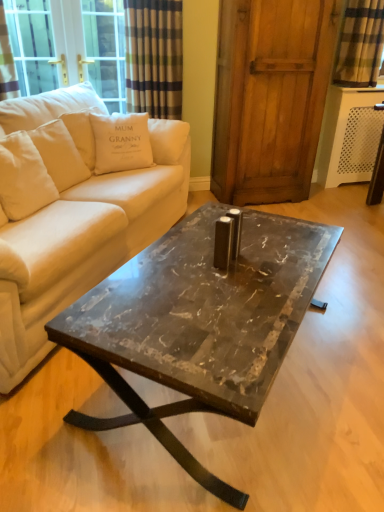
Question: Is beige fabric couch at center facing towards wooden screen door at center?

Choices:
 (A) no
 (B) yes

Answer: (A)

Question: Would you say beige fabric couch at center is a long distance from wooden screen door at center?

Choices:
 (A) no
 (B) yes

Answer: (B)

Question: Is beige fabric couch at center positioned with its back to wooden screen door at center?

Choices:
 (A) no
 (B) yes

Answer: (A)

Question: From a real-world perspective, is beige fabric couch at center physically below wooden screen door at center?

Choices:
 (A) yes
 (B) no

Answer: (A)

Question: Does beige fabric couch at center appear on the right side of wooden screen door at center?

Choices:
 (A) yes
 (B) no

Answer: (B)

Question: Would you say wooden screen door at center is part of beige fabric couch at center's contents?

Choices:
 (A) yes
 (B) no

Answer: (B)

Question: From a real-world perspective, is white cotton cushion at upper left, arranged as the second pillow when viewed from the left, positioned over white cotton pillow at upper left, which appears as the first pillow when viewed from the left, based on gravity?

Choices:
 (A) yes
 (B) no

Answer: (B)

Question: From the image's perspective, is white cotton cushion at upper left, which is the first pillow from right to left, located beneath white cotton pillow at upper left, which ranks as the second pillow in right-to-left order?

Choices:
 (A) no
 (B) yes

Answer: (B)

Question: Can you confirm if white cotton cushion at upper left, arranged as the second pillow when viewed from the left, is wider than white cotton pillow at upper left, which ranks as the second pillow in right-to-left order?

Choices:
 (A) yes
 (B) no

Answer: (A)

Question: Is the position of white cotton cushion at upper left, arranged as the second pillow when viewed from the left, less distant than that of white cotton pillow at upper left, which ranks as the second pillow in right-to-left order?

Choices:
 (A) yes
 (B) no

Answer: (B)

Question: Considering the relative positions of white cotton cushion at upper left, arranged as the second pillow when viewed from the left, and white cotton pillow at upper left, which appears as the first pillow when viewed from the left, in the image provided, is white cotton cushion at upper left, arranged as the second pillow when viewed from the left, to the right of white cotton pillow at upper left, which appears as the first pillow when viewed from the left, from the viewer's perspective?

Choices:
 (A) yes
 (B) no

Answer: (A)

Question: Is white cotton cushion at upper left, arranged as the second pillow when viewed from the left, positioned far away from white cotton pillow at upper left, which ranks as the second pillow in right-to-left order?

Choices:
 (A) yes
 (B) no

Answer: (B)

Question: Can you confirm if white cotton pillow at upper left, which appears as the first pillow when viewed from the left, is positioned to the right of white cotton cushion at upper left, arranged as the second pillow when viewed from the left?

Choices:
 (A) no
 (B) yes

Answer: (A)